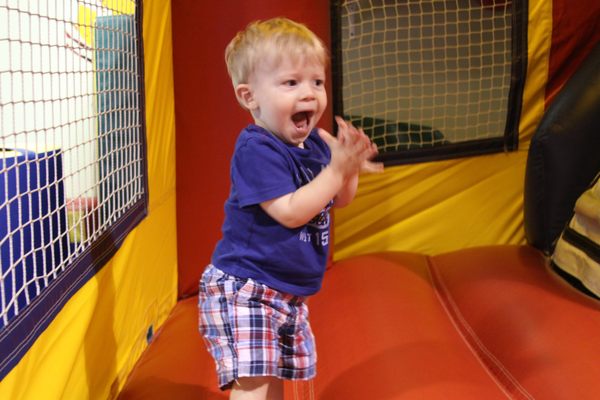
Identify the location of seam in red floor. The image size is (600, 400). (450, 312).